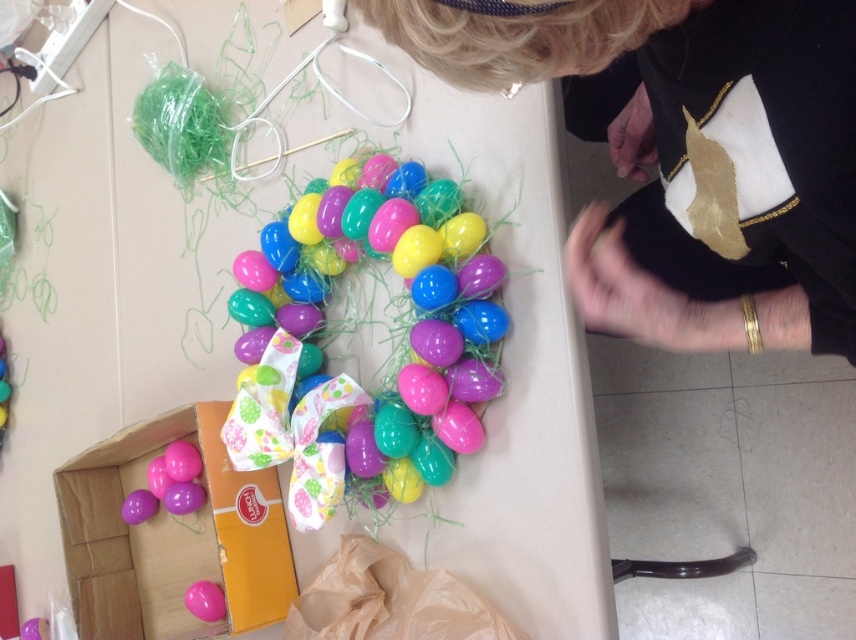
Which is in front, point (495, 540) or point (97, 516)?

Point (495, 540) is more forward.

Does matte plastic table at center appear on the left side of matte pink eggs at lower left?

Indeed, matte plastic table at center is positioned on the left side of matte pink eggs at lower left.

Who is more distant from viewer, (366, 344) or (263, 515)?

The point (263, 515) is more distant.

You are a GUI agent. You are given a task and a screenshot of the screen. Output one action in this format:
    pyautogui.click(x=<x>, y=<y>)
    Task: Click on the matte plastic table at center
    This screenshot has height=640, width=856.
    Given the screenshot: What is the action you would take?
    pyautogui.click(x=105, y=285)

Can you confirm if black fabric at upper center is smaller than pink glossy balloon at lower left?

No.

Measure the distance between point [733,116] and camera.

Point [733,116] and camera are 22.90 inches apart.

Locate an element on the screen. This screenshot has width=856, height=640. black fabric at upper center is located at coordinates (688, 156).

Is point (111, 625) less distant than point (203, 589)?

No.

The width and height of the screenshot is (856, 640). I want to click on matte pink eggs at lower left, so click(171, 536).